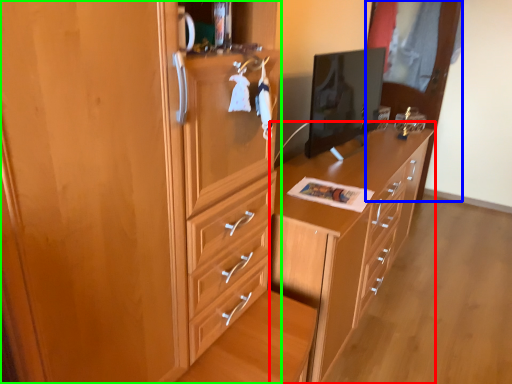
Question: Based on their relative distances, which object is farther from chest of drawers (highlighted by a red box)? Choose from glass door (highlighted by a blue box) and cabinetry (highlighted by a green box).

Choices:
 (A) glass door
 (B) cabinetry

Answer: (A)